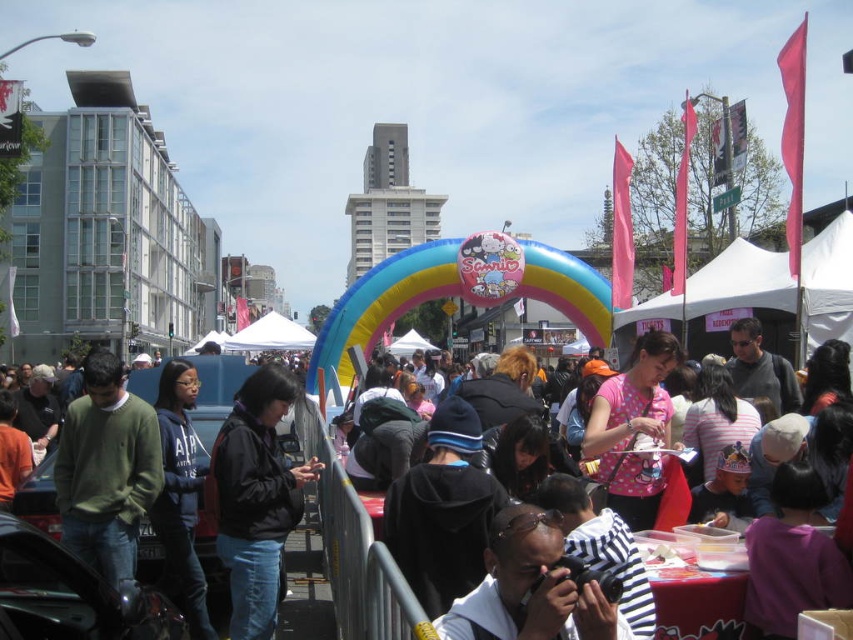
Question: Which point is farther to the camera?

Choices:
 (A) (740, 621)
 (B) (242, 412)

Answer: (B)

Question: Does matte black jacket at center appear on the right side of black matte jacket at center?

Choices:
 (A) no
 (B) yes

Answer: (B)

Question: Can you confirm if matte black jacket at center is positioned below black matte jacket at center?

Choices:
 (A) yes
 (B) no

Answer: (B)

Question: Which point appears closest to the camera in this image?

Choices:
 (A) (328, 532)
 (B) (247, 536)

Answer: (B)

Question: Is matte black jacket at center above black matte jacket at center?

Choices:
 (A) yes
 (B) no

Answer: (A)